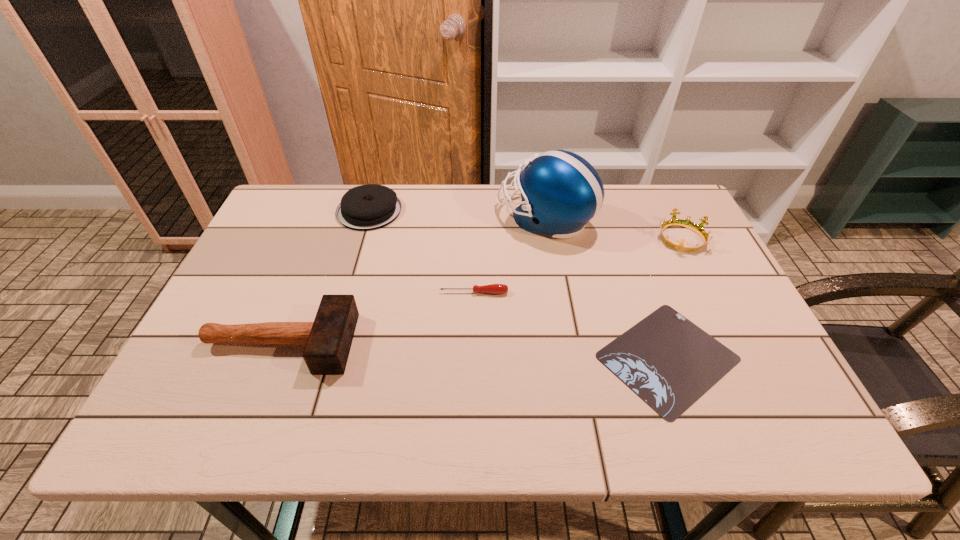
Identify the location of the tallest object. The width and height of the screenshot is (960, 540). (561, 192).

Locate an element on the screen. The image size is (960, 540). the fifth shortest object is located at coordinates (x=328, y=339).

The height and width of the screenshot is (540, 960). I want to click on pancake, so click(367, 207).

At what (x,y) coordinates should I click in order to perform the action: click on crown. Please return your answer as a coordinate pair (x, y). Looking at the image, I should click on (686, 223).

Image resolution: width=960 pixels, height=540 pixels. What are the coordinates of `the third nearest object` in the screenshot? It's located at (492, 288).

The width and height of the screenshot is (960, 540). I want to click on screwdriver, so click(492, 288).

This screenshot has width=960, height=540. I want to click on the shortest object, so click(x=669, y=362).

Locate an element on the screen. The width and height of the screenshot is (960, 540). free space located at the front of the football helmet with the faceguard is located at coordinates (438, 218).

At what (x,y) coordinates should I click in order to perform the action: click on vacant region located at the front of the football helmet with the faceguard. Please return your answer as a coordinate pair (x, y). Image resolution: width=960 pixels, height=540 pixels. Looking at the image, I should click on (381, 218).

This screenshot has height=540, width=960. What are the coordinates of `vacant space located 0.370m at the front of the football helmet with the faceguard` in the screenshot? It's located at [x=374, y=218].